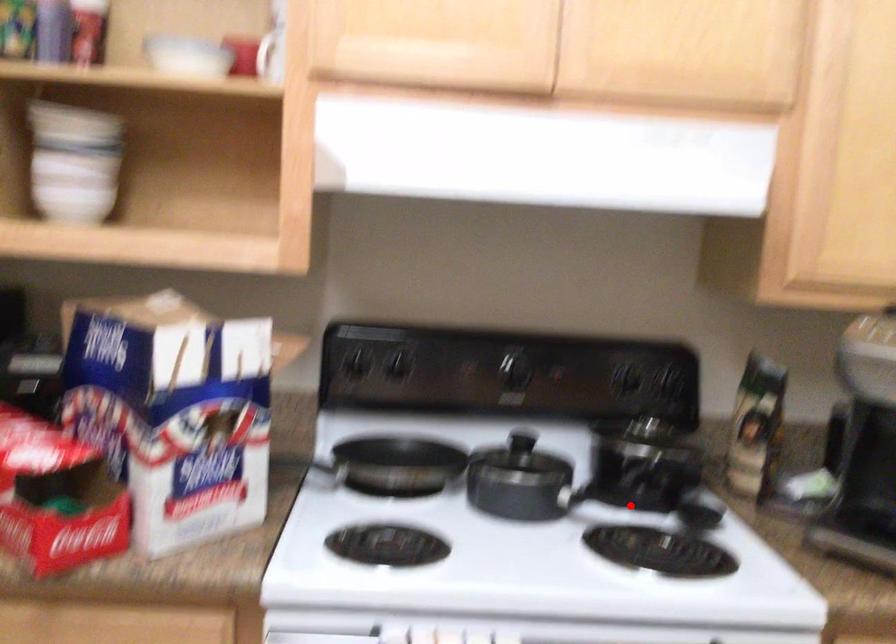
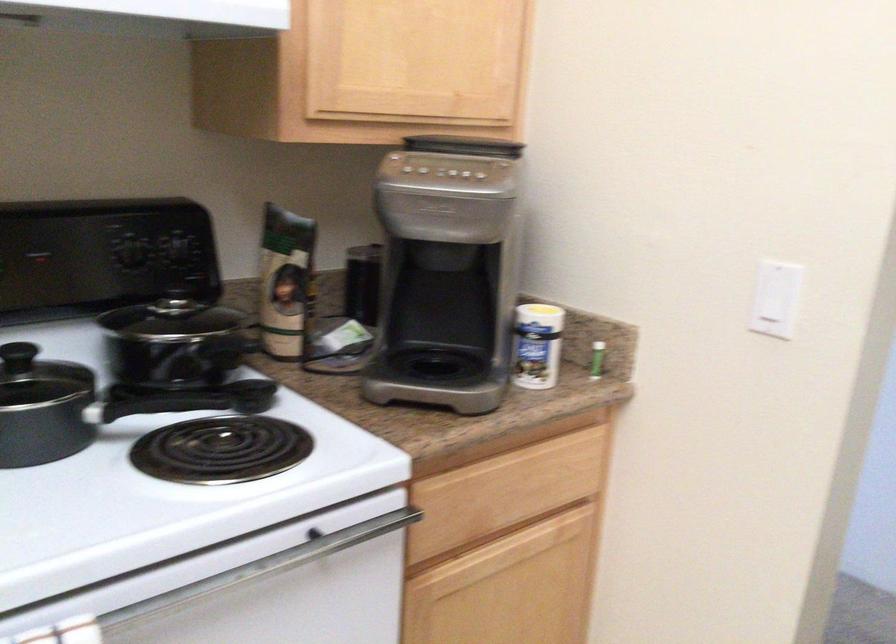
In the second image, find the point that corresponds to the highlighted location in the first image.

(194, 400)